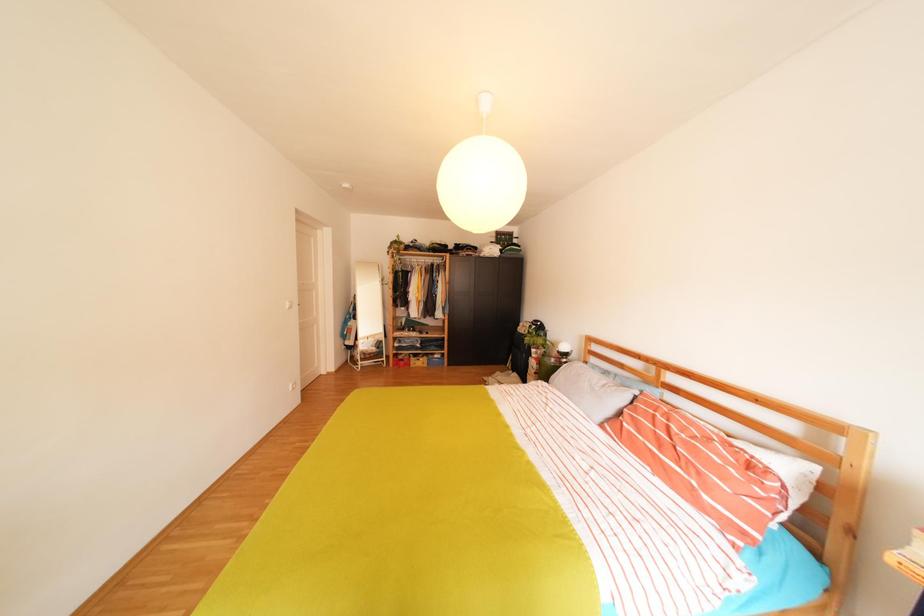
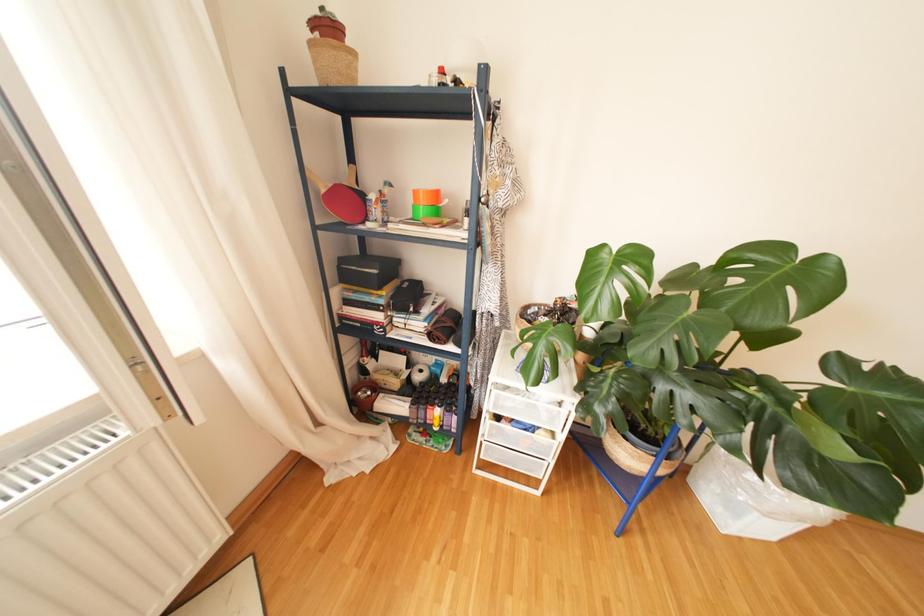
The first image is from the beginning of the video and the second image is from the end. How did the camera likely rotate when shooting the video?

The rotation direction of the camera is left-down.